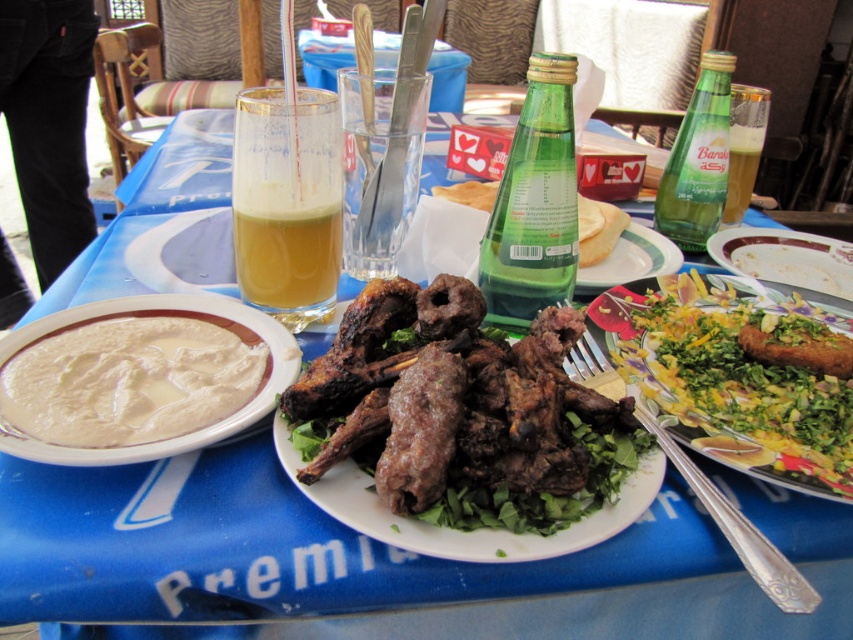
Question: Which object is the farthest from the yellowish-green liquid at center?

Choices:
 (A) brown crispy meat at center
 (B) white creamy hummus at center
 (C) green glass bottle at upper right

Answer: (C)

Question: Among these objects, which one is farthest from the camera?

Choices:
 (A) green glass bottle at upper right
 (B) yellowish-green liquid at center
 (C) floral ceramic plate at center right
 (D) green leafy salad at center

Answer: (A)

Question: Is green glass bottle at center bigger than floral ceramic plate at center right?

Choices:
 (A) yes
 (B) no

Answer: (B)

Question: Which object is farther from the camera taking this photo?

Choices:
 (A) brown crispy meat at center
 (B) green glass bottle at upper right
 (C) floral ceramic plate at center right
 (D) green glass bottle at center

Answer: (B)

Question: Is green leafy salad at center wider than white creamy hummus at center?

Choices:
 (A) no
 (B) yes

Answer: (B)

Question: Does brown crispy meat at center have a greater width compared to green glass bottle at center?

Choices:
 (A) no
 (B) yes

Answer: (B)